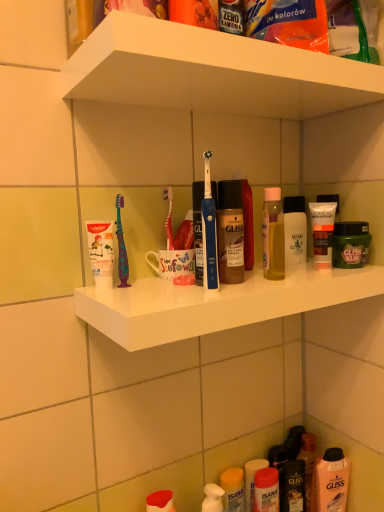
What are the coordinates of `vacant area that is in front of white matte toothpaste tube at left, placed as the first toiletry when sorted from left to right` in the screenshot? It's located at coord(121,298).